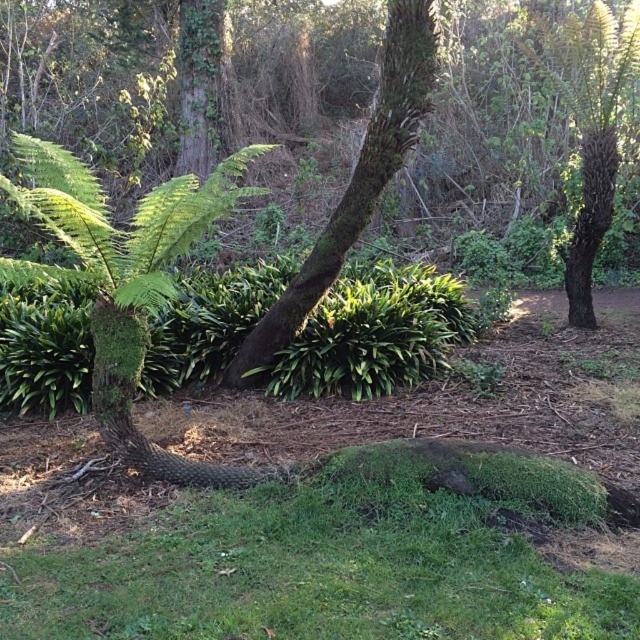
Question: Can you confirm if green mossy grass at lower center is thinner than green mossy tree at upper right?

Choices:
 (A) yes
 (B) no

Answer: (B)

Question: Estimate the real-world distances between objects in this image. Which object is farther from the green mossy grass at lower center?

Choices:
 (A) green mossy tree at upper right
 (B) green mossy bark tree at center

Answer: (A)

Question: Is green mossy bark tree at center to the left of green mossy tree at upper right from the viewer's perspective?

Choices:
 (A) yes
 (B) no

Answer: (A)

Question: From the image, what is the correct spatial relationship of green mossy grass at lower center in relation to green mossy bark tree at center?

Choices:
 (A) below
 (B) above

Answer: (A)

Question: Which object appears farthest from the camera in this image?

Choices:
 (A) green mossy tree at upper right
 (B) green mossy bark tree at center

Answer: (A)

Question: Which object is closer to the camera taking this photo?

Choices:
 (A) green mossy grass at lower center
 (B) green mossy tree at upper right

Answer: (A)